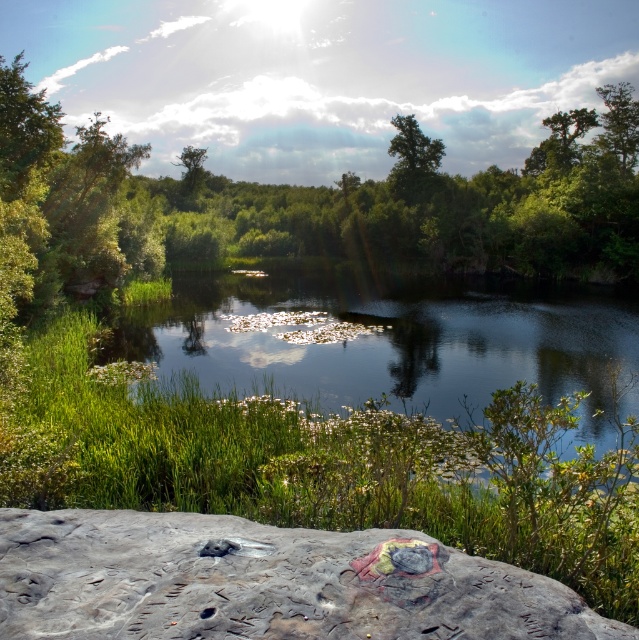
Question: Considering the real-world distances, which object is closest to the rough stone boulder at lower center?

Choices:
 (A) green leafy tree at upper center
 (B) green grassy river at center

Answer: (B)

Question: Is rough stone boulder at lower center bigger than green grassy river at center?

Choices:
 (A) yes
 (B) no

Answer: (B)

Question: Which object is the farthest from the green leafy tree at upper center?

Choices:
 (A) rough stone boulder at lower center
 (B) green grassy river at center

Answer: (A)

Question: Considering the relative positions of rough stone boulder at lower center and green grassy river at center in the image provided, where is rough stone boulder at lower center located with respect to green grassy river at center?

Choices:
 (A) left
 (B) right

Answer: (B)

Question: Is green grassy river at center thinner than green leafy tree at upper center?

Choices:
 (A) no
 (B) yes

Answer: (A)

Question: Considering the real-world distances, which object is farthest from the green grassy river at center?

Choices:
 (A) green leafy tree at upper center
 (B) rough stone boulder at lower center

Answer: (A)